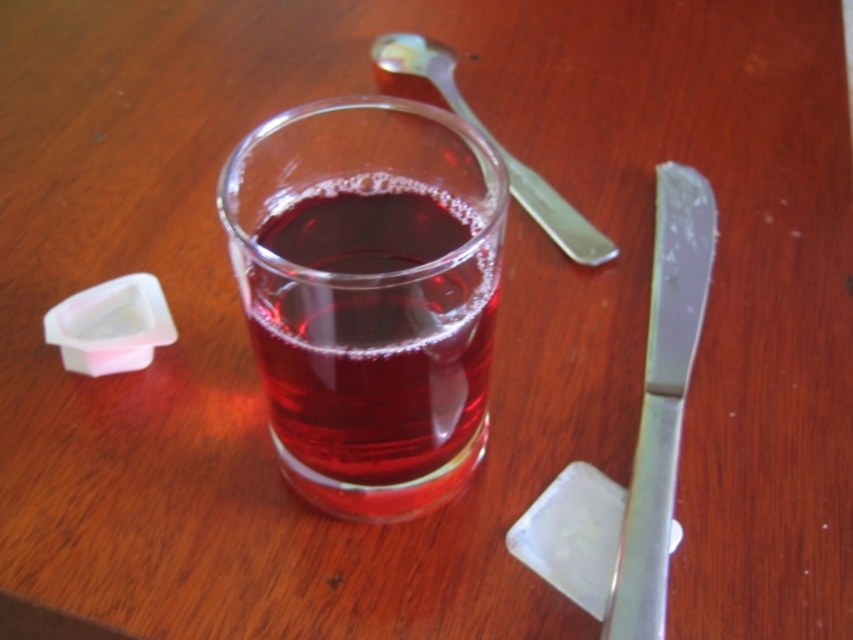
You have a small container that can only hold items narrower than 5 cm. You need to place either the polished metal butter knife at right or the silver metallic spoon at upper center into it. Which one can fit inside the container?

The polished metal butter knife at right has a width less than the silver metallic spoon at upper center. Since the container can only hold items narrower than 5 cm, the butter knife can fit inside the container if its width is under 5 cm, but the spoon cannot.

You are a small robot with a 3.5 inch wide arm. You need to pick up the silver metallic spoon at upper center while avoiding knocking over the translucent glass beverage at center. Is your arm narrow enough to reach the spoon without touching the glass?

The distance between the translucent glass beverage at center and the silver metallic spoon at upper center is 4.38 inches. Since your arm is 3.5 inches wide, it is narrow enough to fit within the space and reach the spoon without touching the glass.

You are setting up a small table for a tea party. You have a translucent glass beverage at center and a polished metal butter knife at right. Where should you place the butter knife relative to the beverage glass to match the image?

The polished metal butter knife at right should be placed to the right of the translucent glass beverage at center, as the butter knife is to the right of the beverage glass in the image.